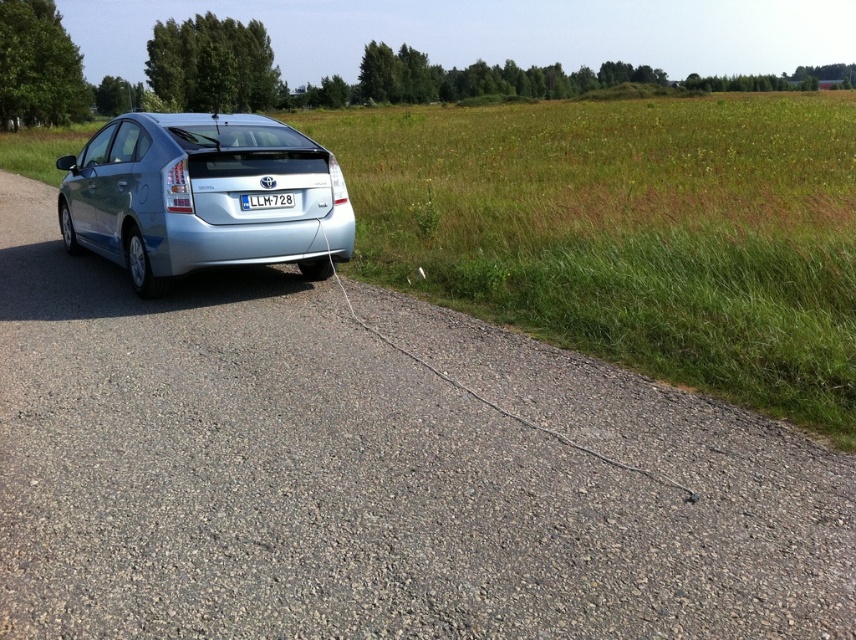
Is satin silver sedan at center positioned behind white plastic license plate at center?

No, it is not.

Describe the element at coordinates (201, 196) in the screenshot. I see `satin silver sedan at center` at that location.

Which is in front, point (74, 250) or point (276, 205)?

Point (276, 205)

I want to click on satin silver sedan at center, so click(201, 196).